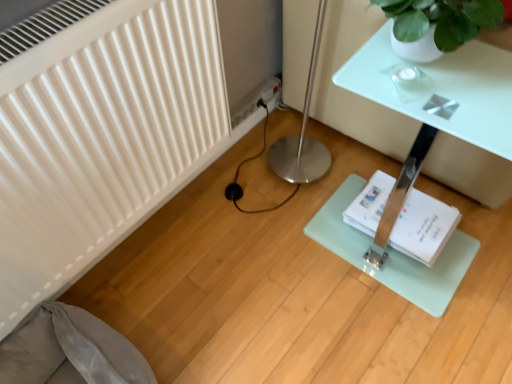
This screenshot has width=512, height=384. I want to click on white matte radiator at left, so click(x=99, y=133).

Is gray fabric swivel chair at lower left to the left of white paper book at center from the viewer's perspective?

Correct, you'll find gray fabric swivel chair at lower left to the left of white paper book at center.

How many degrees apart are the facing directions of gray fabric swivel chair at lower left and white paper book at center?

The angular difference between gray fabric swivel chair at lower left and white paper book at center is 1.13 degrees.

Is gray fabric swivel chair at lower left not within white paper book at center?

Absolutely, gray fabric swivel chair at lower left is external to white paper book at center.

Which point is more forward, (113, 329) or (384, 181)?

Positioned in front is point (113, 329).

Between white paper book at center and clear glass table at center, which one has smaller width?

Thinner between the two is white paper book at center.

Considering the positions of objects white paper book at center and clear glass table at center in the image provided, who is more to the left, white paper book at center or clear glass table at center?

white paper book at center.

Is white paper book at center far from clear glass table at center?

No, white paper book at center is not far away from clear glass table at center.

From a real-world perspective, is white paper book at center above or below clear glass table at center?

Clearly, from a real-world perspective, white paper book at center is below clear glass table at center.

From a real-world perspective, who is located lower, white matte radiator at left or clear glass table at center?

clear glass table at center is physically lower.

Can you confirm if white matte radiator at left is thinner than clear glass table at center?

Yes.

Considering the points (1, 196) and (510, 140), which point is behind, point (1, 196) or point (510, 140)?

The point (510, 140) is more distant.

Between point (18, 132) and point (19, 333), which one is positioned behind?

Point (19, 333)

Can you confirm if white matte radiator at left is positioned to the right of gray fabric swivel chair at lower left?

Correct, you'll find white matte radiator at left to the right of gray fabric swivel chair at lower left.

Is white matte radiator at left taller than gray fabric swivel chair at lower left?

Yes.

Looking at their sizes, would you say white matte radiator at left is wider or thinner than gray fabric swivel chair at lower left?

Clearly, white matte radiator at left has less width compared to gray fabric swivel chair at lower left.

From a real-world perspective, between white paper book at center and gray fabric swivel chair at lower left, who is vertically higher?

In real-world perspective, gray fabric swivel chair at lower left is above.

Looking at this image, can we say white paper book at center lies outside gray fabric swivel chair at lower left?

Yes.

Is gray fabric swivel chair at lower left at the back of white paper book at center?

white paper book at center is not turned away from gray fabric swivel chair at lower left.

Considering the sizes of objects white paper book at center and gray fabric swivel chair at lower left in the image provided, who is bigger, white paper book at center or gray fabric swivel chair at lower left?

gray fabric swivel chair at lower left.

From the image's perspective, is clear glass table at center positioned above or below white paper book at center?

From the image's perspective, clear glass table at center appears above white paper book at center.

How different are the orientations of clear glass table at center and white paper book at center in degrees?

The angle between the facing direction of clear glass table at center and the facing direction of white paper book at center is 0.553 degrees.

Is clear glass table at center far away from white paper book at center?

Actually, clear glass table at center and white paper book at center are a little close together.

Could you tell me if clear glass table at center is turned towards white paper book at center?

No, clear glass table at center is not facing towards white paper book at center.

Consider the image. Considering the relative sizes of clear glass table at center and gray fabric swivel chair at lower left in the image provided, is clear glass table at center wider than gray fabric swivel chair at lower left?

Correct, the width of clear glass table at center exceeds that of gray fabric swivel chair at lower left.

In the image, is clear glass table at center positioned in front of or behind gray fabric swivel chair at lower left?

In the image, clear glass table at center appears behind gray fabric swivel chair at lower left.

From the image's perspective, is clear glass table at center located above or below gray fabric swivel chair at lower left?

clear glass table at center is above gray fabric swivel chair at lower left.

Consider the image. From a real-world perspective, is clear glass table at center above or below gray fabric swivel chair at lower left?

Clearly, from a real-world perspective, clear glass table at center is above gray fabric swivel chair at lower left.

Find the location of `swivel chair above the white paper book at center (from a real-world perspective)`. swivel chair above the white paper book at center (from a real-world perspective) is located at coordinates (69, 350).

Image resolution: width=512 pixels, height=384 pixels. What are the coordinates of `book below the clear glass table at center (from a real-world perspective)` in the screenshot? It's located at (423, 227).

Looking at the image, which one is located further to clear glass table at center, white matte radiator at left or white paper book at center?

The object further to clear glass table at center is white matte radiator at left.

Considering their positions, is gray fabric swivel chair at lower left positioned closer to white matte radiator at left than clear glass table at center?

The object closer to white matte radiator at left is gray fabric swivel chair at lower left.

Estimate the real-world distances between objects in this image. Which object is further from white paper book at center, white matte radiator at left or clear glass table at center?

The object further to white paper book at center is white matte radiator at left.

Which object lies further to the anchor point gray fabric swivel chair at lower left, white matte radiator at left or clear glass table at center?

clear glass table at center lies further to gray fabric swivel chair at lower left than the other object.

From the image, which object appears to be farther from gray fabric swivel chair at lower left, white paper book at center or clear glass table at center?

Based on the image, clear glass table at center appears to be further to gray fabric swivel chair at lower left.

When comparing their distances from white paper book at center, does clear glass table at center or gray fabric swivel chair at lower left seem further?

gray fabric swivel chair at lower left.

When comparing their distances from white matte radiator at left, does gray fabric swivel chair at lower left or white paper book at center seem further?

The object further to white matte radiator at left is white paper book at center.

Considering their positions, is gray fabric swivel chair at lower left positioned further to white paper book at center than clear glass table at center?

gray fabric swivel chair at lower left is further to white paper book at center.

Identify the location of radiator between gray fabric swivel chair at lower left and white paper book at center in the horizontal direction. (99, 133).

What are the coordinates of `book between white matte radiator at left and clear glass table at center in the horizontal direction` in the screenshot? It's located at (423, 227).

At what (x,y) coordinates should I click in order to perform the action: click on radiator located between gray fabric swivel chair at lower left and clear glass table at center in the left-right direction. Please return your answer as a coordinate pair (x, y). The height and width of the screenshot is (384, 512). Looking at the image, I should click on (99, 133).

This screenshot has height=384, width=512. I want to click on book between gray fabric swivel chair at lower left and clear glass table at center from left to right, so tap(423, 227).